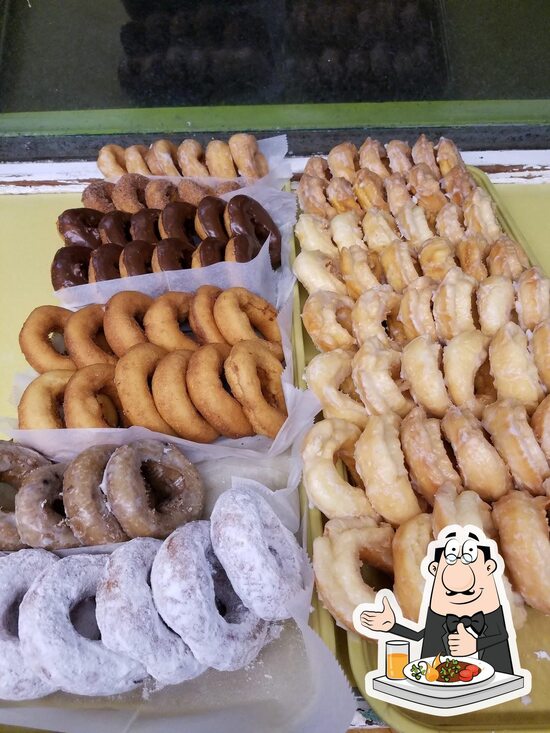
At what (x,y) coordinates should I click in order to perform the action: click on plate. Please return your answer as a coordinate pair (x, y). The image size is (550, 733). Looking at the image, I should click on point(478,670).